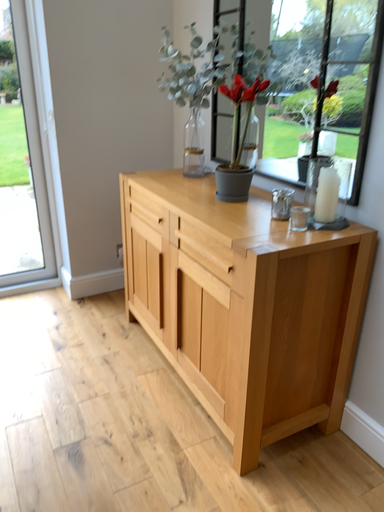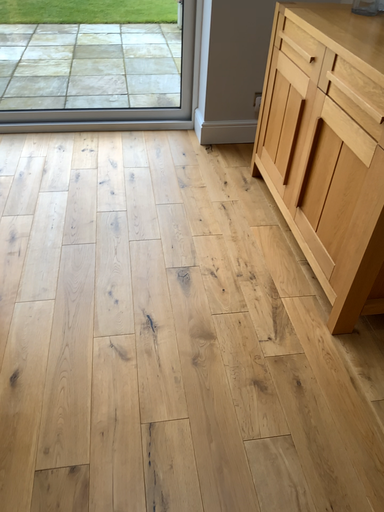
Question: Which way did the camera rotate in the video?

Choices:
 (A) rotated downward
 (B) rotated upward

Answer: (A)